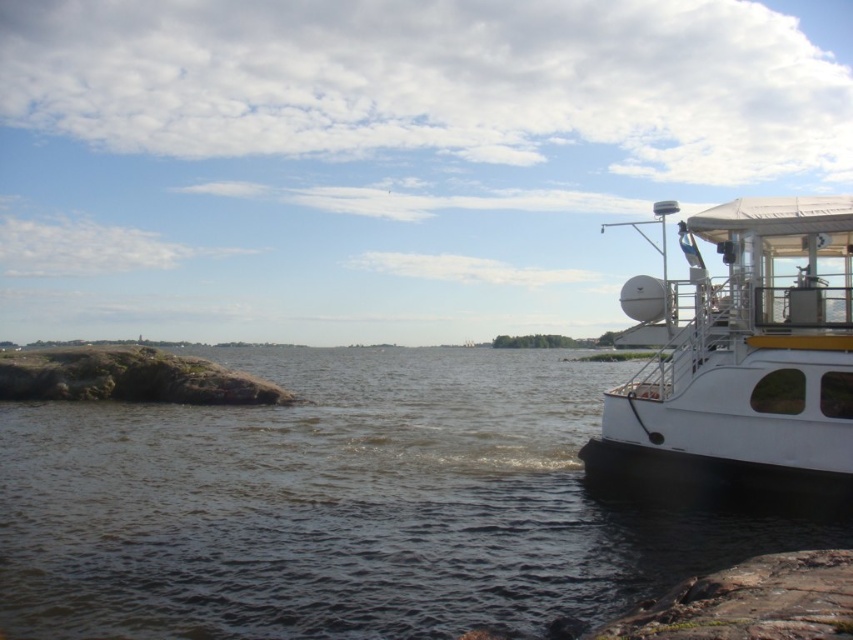
You are standing at the point marked by the coordinates point (350, 506). Based on the scene, what is the terrain like at your current location?

The point (350, 506) marks brown water at lower left, so the terrain at your current location is water.

You are planning to take a photo of the brown water at lower left and the white glossy boat at right. Which object should you focus on first if you want to capture both in a single frame without moving the camera?

The brown water at lower left has a larger width than the white glossy boat at right, so focusing on the brown water at lower left first would ensure both objects fit within the frame since it occupies more space.